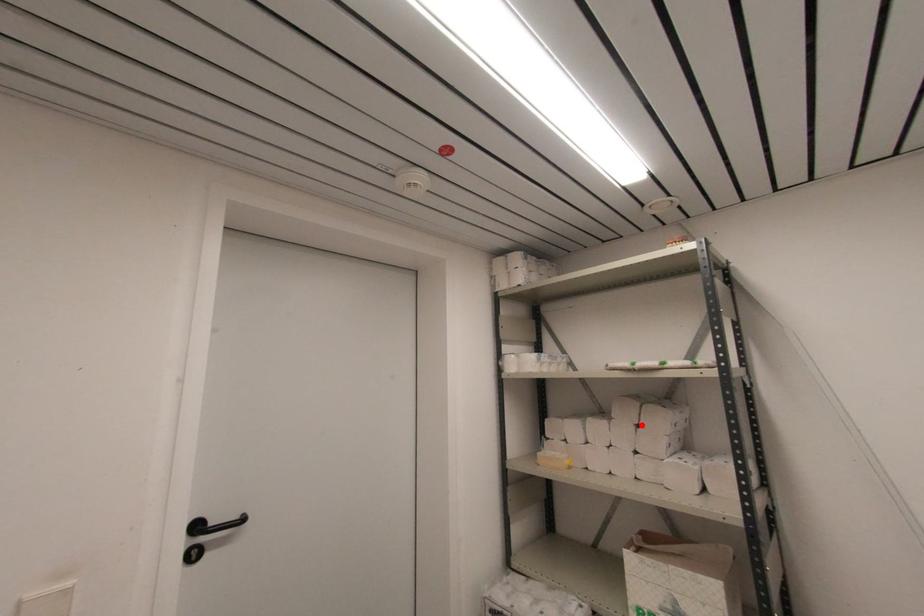
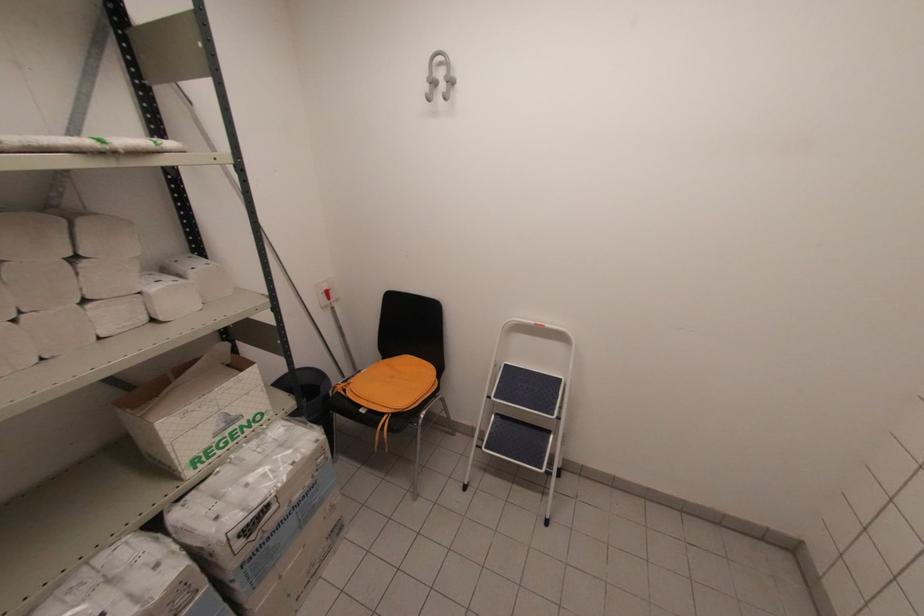
The point at the highlighted location is marked in the first image. Where is the corresponding point in the second image?

(81, 254)